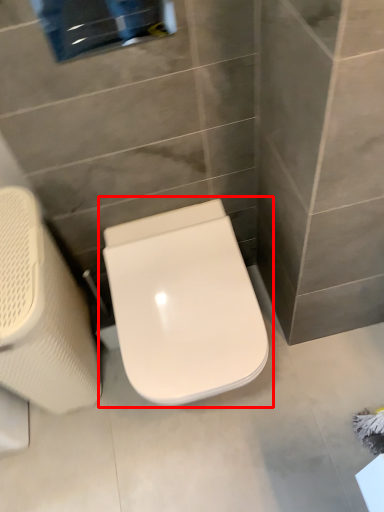
Question: From the image, what is the correct spatial relationship of toilet (annotated by the red box) in relation to swivel chair?

Choices:
 (A) left
 (B) right

Answer: (B)